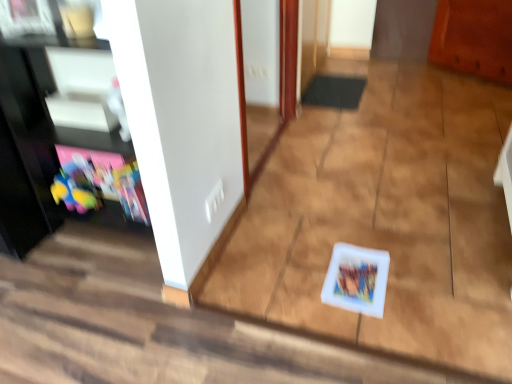
Locate an element on the screen. empty space that is ontop of white matte card game at center is located at coordinates (359, 274).